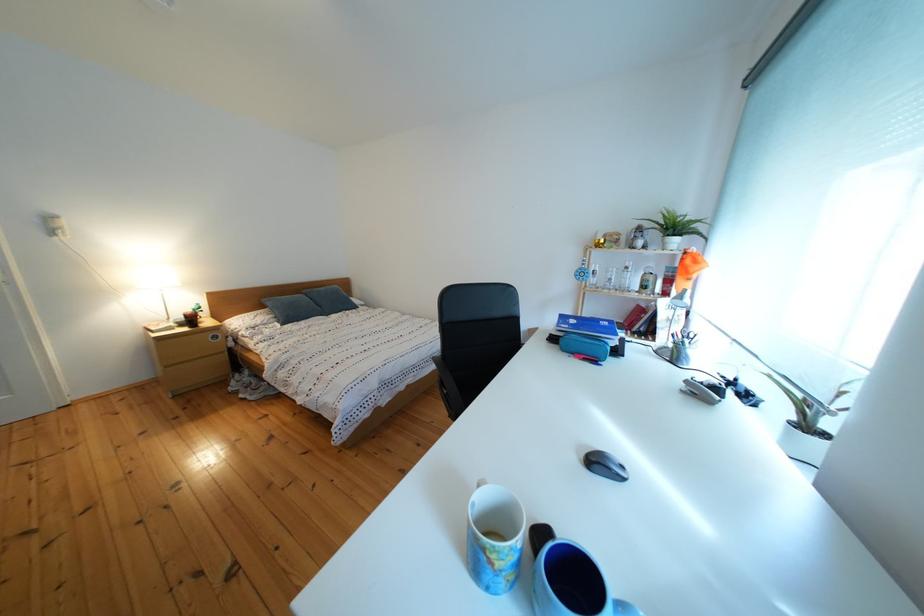
Locate an element on the screen. This screenshot has width=924, height=616. blue pencil case is located at coordinates (573, 584).